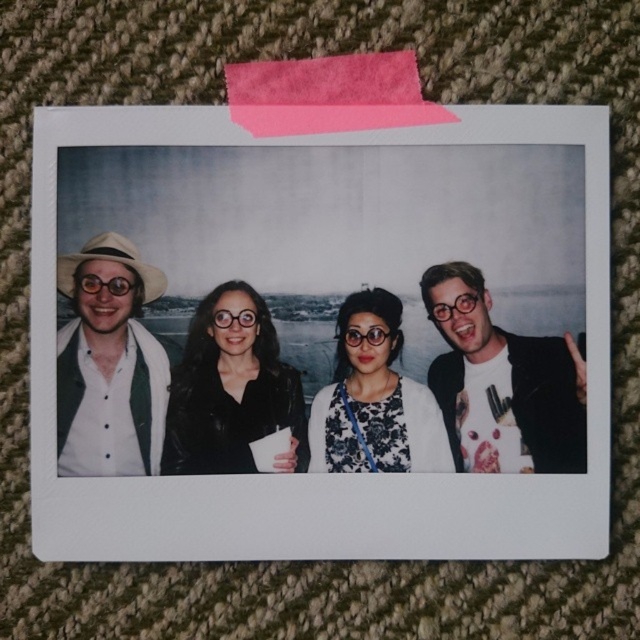
Consider the image. You are organizing a charity event and need to decide which of the two items displayed in the image can be donated. The donation criteria require items to be of a certain size. Given the black leather jacket at center and the floral fabric blouse at center, which item is more likely to fit into the donation box that requires items to be larger than average?

The black leather jacket at center is larger in size than the floral fabric blouse at center, so the black leather jacket at center is more likely to fit into the donation box requiring larger items.

You are looking at the Polaroid photograph on the textured surface. There are two points marked in the photo at coordinates point (134,442) and point (371,410). Which point is closer to you as you view the photograph?

Point (134,442) is in front of point (371,410), so it is closer to you as you view the photograph.